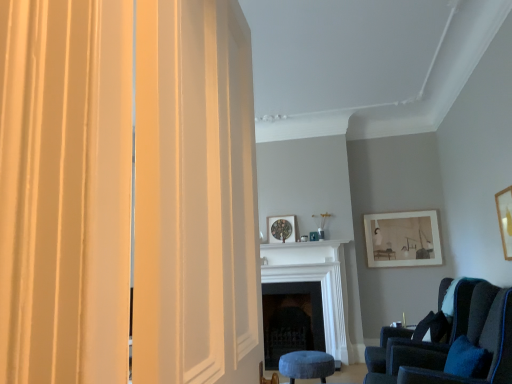
Question: Looking at their shapes, would you say dark wood fireplace at center, marked as the second fireplace in a front-to-back arrangement, is wider or thinner than matte wooden picture frame at center, which is counted as the 3th picture frame, starting from the right?

Choices:
 (A) wide
 (B) thin

Answer: (A)

Question: Based on their positions, is dark wood fireplace at center, the first fireplace viewed from the back, located to the left or right of matte wooden picture frame at center, placed as the first picture frame when sorted from back to front?

Choices:
 (A) right
 (B) left

Answer: (A)

Question: Estimate the real-world distances between objects in this image. Which object is closer to the velvet blue stool at lower center?

Choices:
 (A) wooden picture frame at upper right, which is the first picture frame from front to back
 (B) velvet dark blue chair at lower right
 (C) white marble fireplace at center, which is the 1th fireplace in front-to-back order
 (D) matte wooden picture frame at center, acting as the first picture frame starting from the left
 (E) dark wood fireplace at center, marked as the second fireplace in a front-to-back arrangement

Answer: (B)

Question: Considering the real-world distances, which object is closest to the matte cream curtain at left?

Choices:
 (A) dark wood fireplace at center, marked as the second fireplace in a front-to-back arrangement
 (B) matte wooden picture frame at center, which is counted as the 3th picture frame, starting from the right
 (C) velvet blue stool at lower center
 (D) velvet dark blue chair at lower right
 (E) matte wooden picture frame at upper right, arranged as the second picture frame when viewed from the front

Answer: (D)